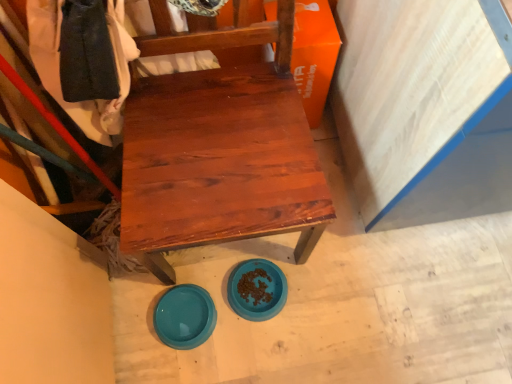
Find the location of `blank space to the left of teal glossy plate at lower center, which is the second plate in right-to-left order`. blank space to the left of teal glossy plate at lower center, which is the second plate in right-to-left order is located at coordinates (133, 314).